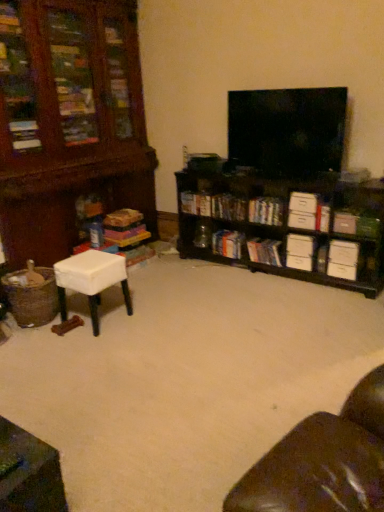
What is the approximate width of hardcover books at center, which is the fourth book in right-to-left order?

hardcover books at center, which is the fourth book in right-to-left order, is 7.01 inches in width.

The image size is (384, 512). Identify the location of black glossy flat-screen tv at upper center. (287, 130).

At what (x,y) coordinates should I click in order to perform the action: click on hardcover books at center, which is the fourth book in right-to-left order. Please return your answer as a coordinate pair (x, y). This screenshot has height=512, width=384. Looking at the image, I should click on (264, 251).

From the image's perspective, between hardcover book at center, placed as the fifth book when sorted from right to left, and hardcover books at center, marked as the sixth book in a right-to-left arrangement, which one is located above?

hardcover books at center, marked as the sixth book in a right-to-left arrangement, appears higher in the image.

Is hardcover book at center, placed as the fifth book when sorted from right to left, aimed at hardcover books at center, marked as the sixth book in a right-to-left arrangement?

No, hardcover book at center, placed as the fifth book when sorted from right to left, does not turn towards hardcover books at center, marked as the sixth book in a right-to-left arrangement.

Is hardcover book at center, placed as the fifth book when sorted from right to left, thinner than hardcover books at center, marked as the sixth book in a right-to-left arrangement?

In fact, hardcover book at center, placed as the fifth book when sorted from right to left, might be wider than hardcover books at center, marked as the sixth book in a right-to-left arrangement.

Is hardcover book at center, placed as the fifth book when sorted from right to left, directly adjacent to hardcover books at center, placed as the second book when sorted from left to right?

hardcover book at center, placed as the fifth book when sorted from right to left, and hardcover books at center, placed as the second book when sorted from left to right, are not in contact.

From the image's perspective, which is above, hardcover books at center, marked as the sixth book in a right-to-left arrangement, or black wood shelf at center right?

hardcover books at center, marked as the sixth book in a right-to-left arrangement.

From a real-world perspective, is hardcover books at center, marked as the sixth book in a right-to-left arrangement, located higher than black wood shelf at center right?

Yes.

How much distance is there between hardcover books at center, placed as the second book when sorted from left to right, and black wood shelf at center right?

16.12 inches.

Looking at the image, does hardcover books at center, placed as the second book when sorted from left to right, seem bigger or smaller compared to black wood shelf at center right?

hardcover books at center, placed as the second book when sorted from left to right, is smaller than black wood shelf at center right.

From a real-world perspective, between wooden table at lower left, arranged as the 2th table when viewed from the top, and white cardboard drawer at right, positioned as the 1th drawer in bottom-to-top order, who is vertically higher?

From a 3D spatial view, white cardboard drawer at right, positioned as the 1th drawer in bottom-to-top order, is above.

Is wooden table at lower left, arranged as the 2th table when viewed from the top, further to camera compared to white cardboard drawer at right, positioned as the fifth drawer in top-to-bottom order?

No, it is in front of white cardboard drawer at right, positioned as the fifth drawer in top-to-bottom order.

Is wooden table at lower left, marked as the 2th table in a back-to-front arrangement, aimed at white cardboard drawer at right, positioned as the fifth drawer in top-to-bottom order?

Yes, wooden table at lower left, marked as the 2th table in a back-to-front arrangement, is oriented towards white cardboard drawer at right, positioned as the fifth drawer in top-to-bottom order.

How different are the orientations of wooden table at lower left, the 1th table when ordered from bottom to top, and white cardboard drawer at right, positioned as the fifth drawer in top-to-bottom order, in degrees?

wooden table at lower left, the 1th table when ordered from bottom to top, and white cardboard drawer at right, positioned as the fifth drawer in top-to-bottom order, are facing 175 degrees away from each other.

Who is bigger, white cardboard drawer at right, positioned as the 1th drawer in bottom-to-top order, or hardcover books at center, placed as the second book when sorted from left to right?

With larger size is hardcover books at center, placed as the second book when sorted from left to right.

Which point is more distant from viewer, (339, 274) or (238, 210)?

The point (238, 210) is more distant.

From the image's perspective, is white cardboard drawer at right, positioned as the fifth drawer in top-to-bottom order, beneath hardcover books at center, placed as the second book when sorted from left to right?

Yes.

How different are the orientations of hardcover book at center, placed as the fifth book when sorted from right to left, and white cardboard drawer at right, which is the third drawer from top to bottom, in degrees?

There is a 2.89-degree angle between the facing directions of hardcover book at center, placed as the fifth book when sorted from right to left, and white cardboard drawer at right, which is the third drawer from top to bottom.

Measure the distance between hardcover book at center, which ranks as the third book in left-to-right order, and white cardboard drawer at right, which is the third drawer from top to bottom.

The distance of hardcover book at center, which ranks as the third book in left-to-right order, from white cardboard drawer at right, which is the third drawer from top to bottom, is 35.21 inches.

Which is more to the right, hardcover book at center, which ranks as the third book in left-to-right order, or white cardboard drawer at right, which is the third drawer from top to bottom?

white cardboard drawer at right, which is the third drawer from top to bottom, is more to the right.

Which is in front, point (239, 241) or point (341, 264)?

The point (341, 264) is closer.

Is hardcover books at center, the fourth book from the left, far away from matte cardboard book at left, the 1th book when ordered from left to right?

Yes, hardcover books at center, the fourth book from the left, is far from matte cardboard book at left, the 1th book when ordered from left to right.

Is hardcover books at center, the fourth book from the left, oriented away from matte cardboard book at left, the 1th book when ordered from left to right?

hardcover books at center, the fourth book from the left, is not turned away from matte cardboard book at left, the 1th book when ordered from left to right.

Does hardcover books at center, the fourth book from the left, appear on the right side of matte cardboard book at left, the 1th book when ordered from left to right?

Correct, you'll find hardcover books at center, the fourth book from the left, to the right of matte cardboard book at left, the 1th book when ordered from left to right.

Does point (242, 250) appear closer or farther from the camera than point (311, 226)?

Clearly, point (242, 250) is more distant from the camera than point (311, 226).

Can you confirm if black wood shelf at center right is shorter than white cardboard drawer at center right, which appears as the 4th drawer when ordered from the bottom?

In fact, black wood shelf at center right may be taller than white cardboard drawer at center right, which appears as the 4th drawer when ordered from the bottom.

Would you say black wood shelf at center right is inside or outside white cardboard drawer at center right, which ranks as the 2th drawer in top-to-bottom order?

The correct answer is: outside.

Where is `the 4th book located beneath the hardcover books at center, marked as the sixth book in a right-to-left arrangement (from a real-world perspective)`? The width and height of the screenshot is (384, 512). the 4th book located beneath the hardcover books at center, marked as the sixth book in a right-to-left arrangement (from a real-world perspective) is located at coordinates (228, 244).

From the image's perspective, count 3rd books upward from the black wood shelf at center right and point to it. Please provide its 2D coordinates.

[(229, 207)]

From the image, which object appears to be farther from white fabric stool at lower left, which ranks as the 1th table in top-to-bottom order, black wood shelf at center right or hardcover books at center, marked as the sixth book in a right-to-left arrangement?

black wood shelf at center right lies further to white fabric stool at lower left, which ranks as the 1th table in top-to-bottom order, than the other object.

Considering their positions, is white fabric stool at lower left, the 2th table in the bottom-to-top sequence, positioned closer to white cardboard box at right, which ranks as the 1th book in right-to-left order, than black glossy flat-screen tv at upper center?

black glossy flat-screen tv at upper center.

Considering their positions, is white cardboard box at center-right, which ranks as the fifth book in left-to-right order, positioned closer to hardcover book at center, which ranks as the third book in left-to-right order, than black wood shelf at center right?

white cardboard box at center-right, which ranks as the fifth book in left-to-right order, lies closer to hardcover book at center, which ranks as the third book in left-to-right order, than the other object.

Estimate the real-world distances between objects in this image. Which object is further from hardcover books at center, which is the fourth book in right-to-left order, white cardboard drawer at right, positioned as the 1th drawer in bottom-to-top order, or wooden table at lower left, the 1th table when ordered from bottom to top?

Among the two, wooden table at lower left, the 1th table when ordered from bottom to top, is located further to hardcover books at center, which is the fourth book in right-to-left order.

When comparing their distances from white cardboard box at right, marked as the second book in a right-to-left arrangement, does white fabric stool at lower left, which ranks as the 1th table in top-to-bottom order, or white cardboard drawer at center right, which appears as the 4th drawer when ordered from the bottom, seem closer?

Based on the image, white cardboard drawer at center right, which appears as the 4th drawer when ordered from the bottom, appears to be nearer to white cardboard box at right, marked as the second book in a right-to-left arrangement.

When comparing their distances from white cardboard box at right, marked as the second book in a right-to-left arrangement, does white cardboard box at center-right, which ranks as the third book in right-to-left order, or white cardboard drawer at center right, which ranks as the 2th drawer in top-to-bottom order, seem closer?

Among the two, white cardboard drawer at center right, which ranks as the 2th drawer in top-to-bottom order, is located nearer to white cardboard box at right, marked as the second book in a right-to-left arrangement.

When comparing their distances from white cardboard box at right, which ranks as the 1th book in right-to-left order, does matte cardboard book at left, the 1th book when ordered from left to right, or wooden table at lower left, marked as the 2th table in a back-to-front arrangement, seem closer?

matte cardboard book at left, the 1th book when ordered from left to right, is closer to white cardboard box at right, which ranks as the 1th book in right-to-left order.

Which object lies further to the anchor point white fabric stool at lower left, which ranks as the 1th table in top-to-bottom order, white cardboard box at right, marked as the second book in a right-to-left arrangement, or black glossy flat-screen tv at upper center?

Based on the image, white cardboard box at right, marked as the second book in a right-to-left arrangement, appears to be further to white fabric stool at lower left, which ranks as the 1th table in top-to-bottom order.

You are a GUI agent. You are given a task and a screenshot of the screen. Output one action in this format:
    pyautogui.click(x=<x>, y=<y>)
    Task: Click on the drawer that lies between black glossy flat-screen tv at upper center and white cardboard drawer at center right, which ranks as the 2th drawer in top-to-bottom order, from top to bottom
    The height and width of the screenshot is (512, 384).
    Given the screenshot: What is the action you would take?
    pyautogui.click(x=303, y=203)

Find the location of a particular element. The image size is (384, 512). book between black glossy flat-screen tv at upper center and white cardboard drawer at center right, placed as the 5th drawer when sorted from bottom to top, vertically is located at coordinates (229, 207).

Where is `television between white fabric stool at lower left, the 2th table in the bottom-to-top sequence, and white cardboard box at right, the 6th book positioned from the left, in the horizontal direction`? television between white fabric stool at lower left, the 2th table in the bottom-to-top sequence, and white cardboard box at right, the 6th book positioned from the left, in the horizontal direction is located at coordinates (287, 130).

Image resolution: width=384 pixels, height=512 pixels. In order to click on drawer situated between white cardboard drawer at lower right, placed as the fourth drawer when sorted from top to bottom, and white cardboard drawer at right, positioned as the 1th drawer in bottom-to-top order, from left to right in this screenshot , I will do `click(343, 253)`.